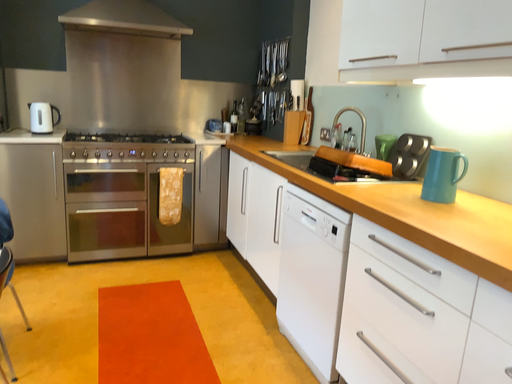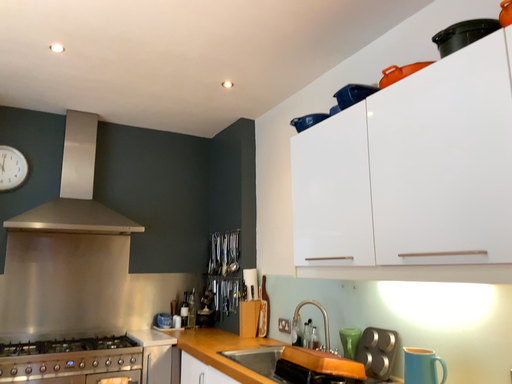
Question: Which way did the camera rotate in the video?

Choices:
 (A) rotated downward
 (B) rotated upward

Answer: (B)